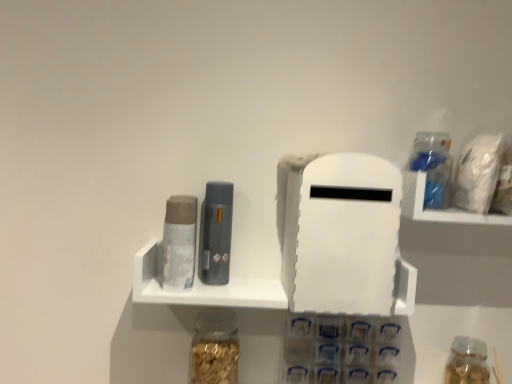
Question: Does translucent plastic bottle at upper right, the 3th bottle ordered from the bottom, have a greater width compared to matte gray canister at center left, the 1th toiletry when ordered from left to right?

Choices:
 (A) no
 (B) yes

Answer: (A)

Question: Is translucent plastic bottle at upper right, the 3th bottle ordered from the bottom, not within matte gray canister at center left, the 1th toiletry when ordered from left to right?

Choices:
 (A) yes
 (B) no

Answer: (A)

Question: Does translucent plastic bottle at upper right, placed as the first bottle when sorted from top to bottom, have a lesser height compared to matte gray canister at center left, the 1th toiletry when ordered from left to right?

Choices:
 (A) no
 (B) yes

Answer: (B)

Question: Does translucent plastic bottle at upper right, the 2th bottle when ordered from right to left, appear on the right side of matte gray canister at center left, arranged as the second toiletry when viewed from the right?

Choices:
 (A) yes
 (B) no

Answer: (A)

Question: Does translucent plastic bottle at upper right, the 3th bottle ordered from the bottom, have a larger size compared to matte gray canister at center left, arranged as the second toiletry when viewed from the right?

Choices:
 (A) no
 (B) yes

Answer: (A)

Question: From a real-world perspective, is translucent plastic bottle at upper right, the second bottle in the left-to-right sequence, on top of matte gray canister at center left, arranged as the second toiletry when viewed from the right?

Choices:
 (A) no
 (B) yes

Answer: (B)

Question: Does translucent plastic container at upper right have a lesser width compared to white matte plastic shelf at center?

Choices:
 (A) no
 (B) yes

Answer: (A)

Question: Does translucent plastic container at upper right turn towards white matte plastic shelf at center?

Choices:
 (A) no
 (B) yes

Answer: (A)

Question: From a real-world perspective, is translucent plastic container at upper right positioned over white matte plastic shelf at center based on gravity?

Choices:
 (A) no
 (B) yes

Answer: (B)

Question: Does translucent plastic container at upper right have a greater width compared to white matte plastic shelf at center?

Choices:
 (A) yes
 (B) no

Answer: (A)

Question: Is translucent plastic container at upper right to the right of white matte plastic shelf at center from the viewer's perspective?

Choices:
 (A) no
 (B) yes

Answer: (B)

Question: Can you confirm if translucent plastic container at upper right is shorter than white matte plastic shelf at center?

Choices:
 (A) no
 (B) yes

Answer: (A)

Question: Does translucent glass jar at lower center, the 1th bottle viewed from the left, have a lesser height compared to translucent plastic container at upper right?

Choices:
 (A) no
 (B) yes

Answer: (A)